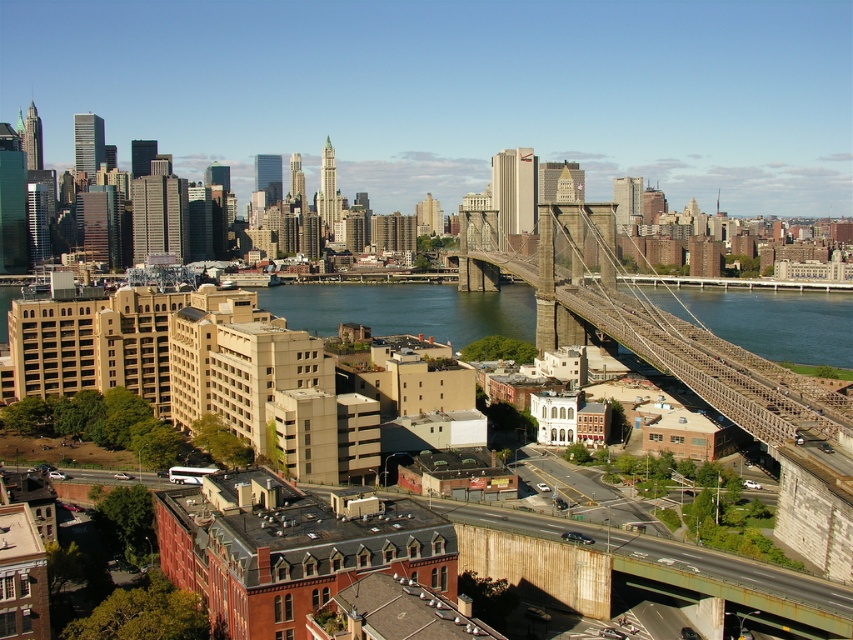
Is dark gray steel suspension bridge at center taller than blue water at center?

Yes.

Find the location of a particular element. The height and width of the screenshot is (640, 853). dark gray steel suspension bridge at center is located at coordinates (648, 326).

Where is `dark gray steel suspension bridge at center`? dark gray steel suspension bridge at center is located at coordinates (648, 326).